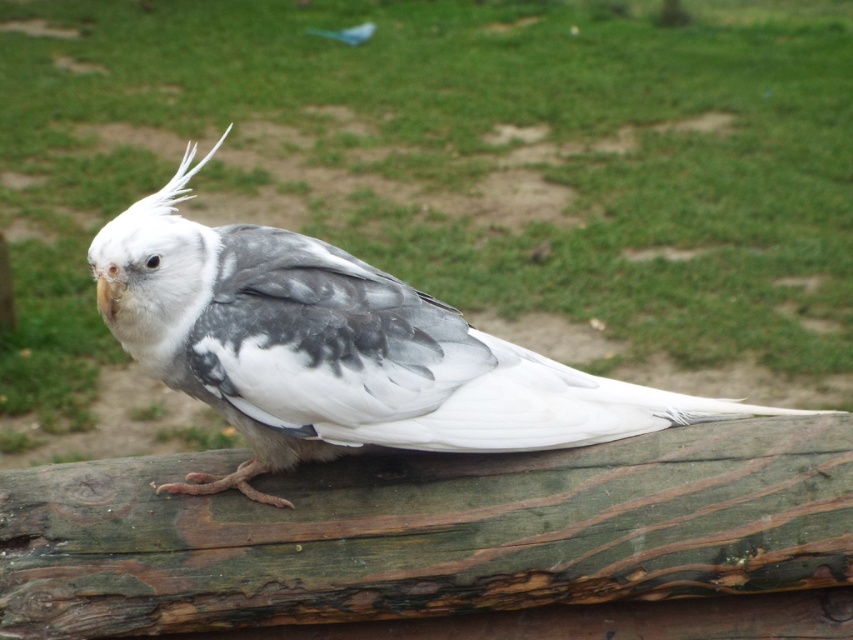
You are a photographer setting up a shot of the bird on the weathered wood at center. Your camera is positioned 2 meters away from the wood. Can you adjust your position to get the wood in focus without moving the camera?

The weathered wood at center is 2.35 meters away from the camera. Since your current position is 2 meters away, you need to move the camera 0.35 meters closer to the wood to achieve focus.